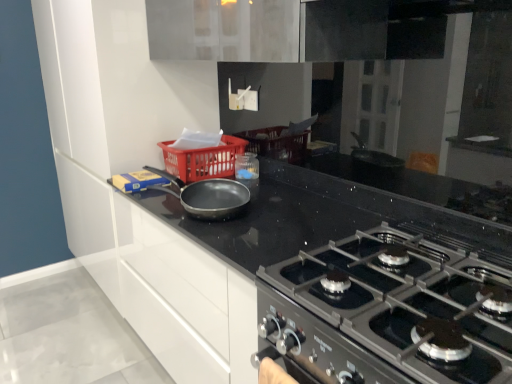
Question: From a real-world perspective, is black granite countertop at center positioned above or below black matte gas stove at center?

Choices:
 (A) below
 (B) above

Answer: (A)

Question: From their relative heights in the image, would you say black granite countertop at center is taller or shorter than black matte gas stove at center?

Choices:
 (A) short
 (B) tall

Answer: (B)

Question: Estimate the real-world distances between objects in this image. Which object is closer to the matte black frying pan at center?

Choices:
 (A) black granite countertop at center
 (B) black matte gas stove at center
 (C) plastic basket at center

Answer: (C)

Question: Which object is positioned farthest from the black matte gas stove at center?

Choices:
 (A) plastic basket at center
 (B) black granite countertop at center
 (C) matte black frying pan at center

Answer: (A)